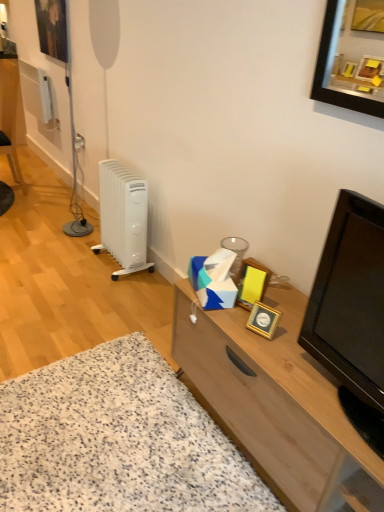
The width and height of the screenshot is (384, 512). I want to click on vacant area that is situated to the right of gold metallic picture frame at center-right, the second picture frame when ordered from bottom to top, so click(287, 303).